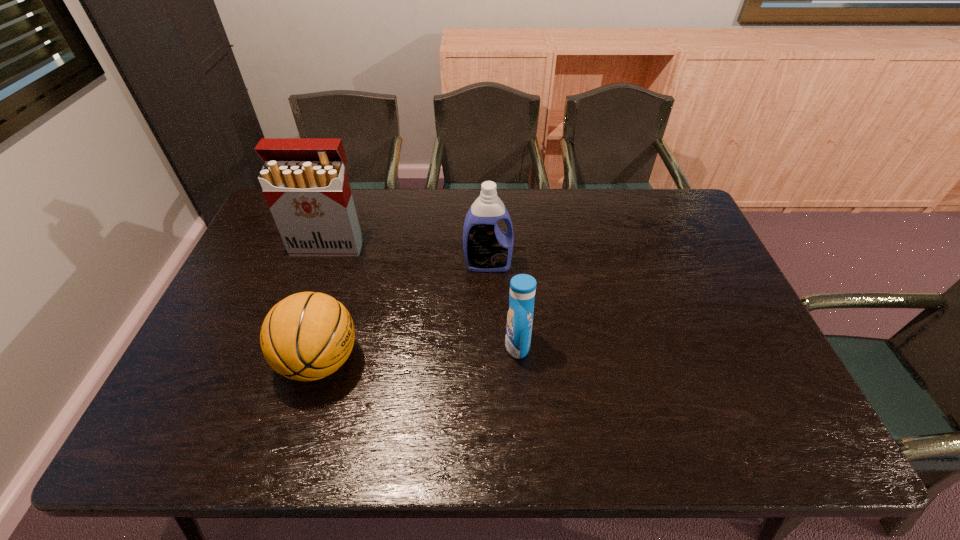
You are a GUI agent. You are given a task and a screenshot of the screen. Output one action in this format:
    pyautogui.click(x=<x>, y=<y>)
    Task: Click on the free space between the shorter detergent and the taller detergent
    The height and width of the screenshot is (540, 960).
    Given the screenshot: What is the action you would take?
    pyautogui.click(x=503, y=305)

You are a GUI agent. You are given a task and a screenshot of the screen. Output one action in this format:
    pyautogui.click(x=<x>, y=<y>)
    Task: Click on the free space between the nearer detergent and the basketball
    Image resolution: width=960 pixels, height=540 pixels.
    Given the screenshot: What is the action you would take?
    pyautogui.click(x=419, y=353)

Where is `vacant space that is in between the nearer detergent and the tallest object`? The height and width of the screenshot is (540, 960). vacant space that is in between the nearer detergent and the tallest object is located at coordinates (422, 295).

You are a GUI agent. You are given a task and a screenshot of the screen. Output one action in this format:
    pyautogui.click(x=<x>, y=<y>)
    Task: Click on the free space between the basketball and the nearer detergent
    The image size is (960, 540).
    Given the screenshot: What is the action you would take?
    pyautogui.click(x=419, y=353)

In order to click on vacant area that lies between the basketball and the second tallest object in this screenshot , I will do `click(404, 313)`.

Where is `object that stands as the closest to the nearer detergent`? object that stands as the closest to the nearer detergent is located at coordinates (487, 248).

Where is `object that stands as the third closest to the shorter detergent`? object that stands as the third closest to the shorter detergent is located at coordinates (304, 180).